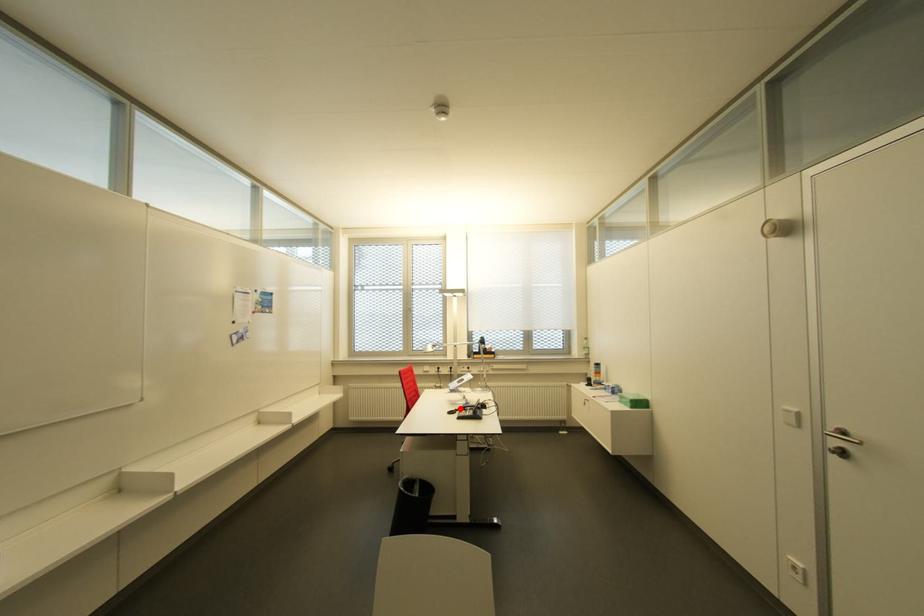
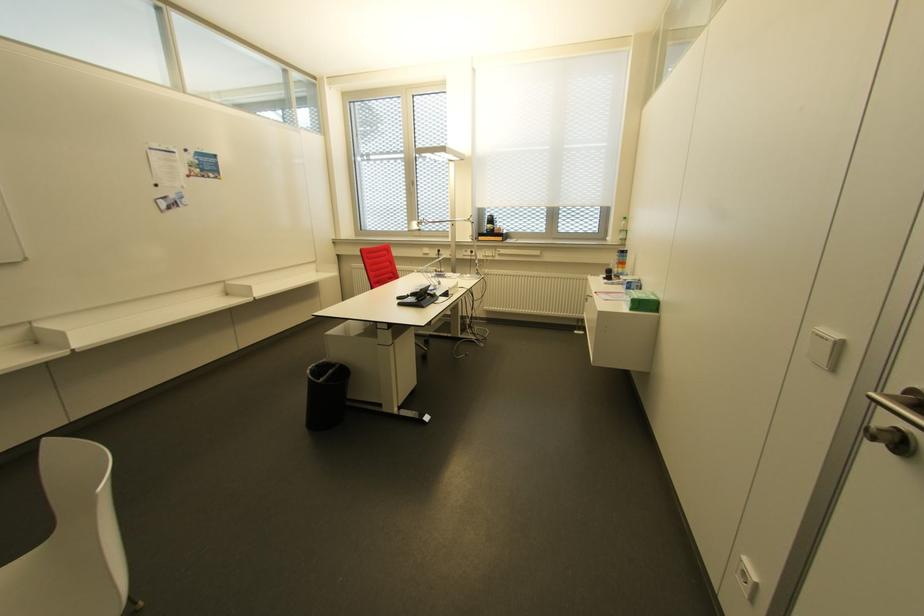
Locate, in the second image, the point that corresponds to the highlighted location in the first image.

(410, 294)